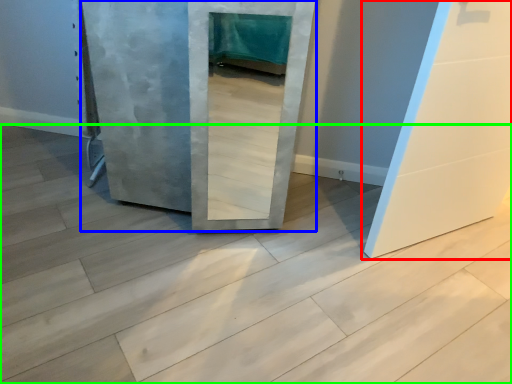
Question: Which object is positioned closest to door (highlighted by a red box)? Select from door (highlighted by a blue box) and concrete (highlighted by a green box).

Choices:
 (A) door
 (B) concrete

Answer: (B)